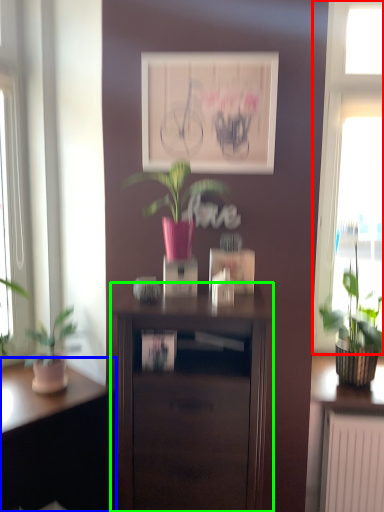
Question: Which object is the farthest from window (highlighted by a red box)? Choose among these: desk (highlighted by a blue box) or nightstand (highlighted by a green box).

Choices:
 (A) desk
 (B) nightstand

Answer: (A)